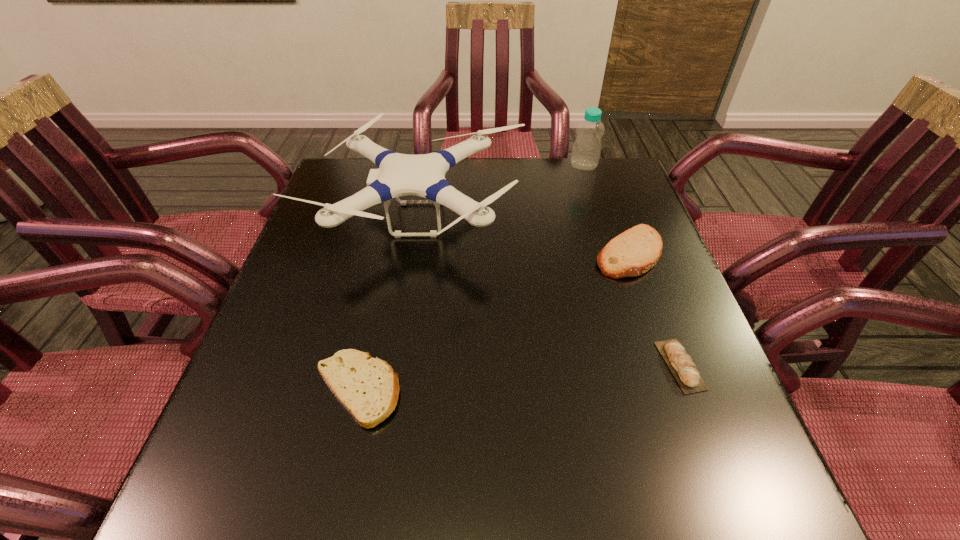
Locate an element on the screen. The height and width of the screenshot is (540, 960). vacant area that satisfies the following two spatial constraints: 1. on the back side of the drone; 2. on the left side of the bottle is located at coordinates (426, 165).